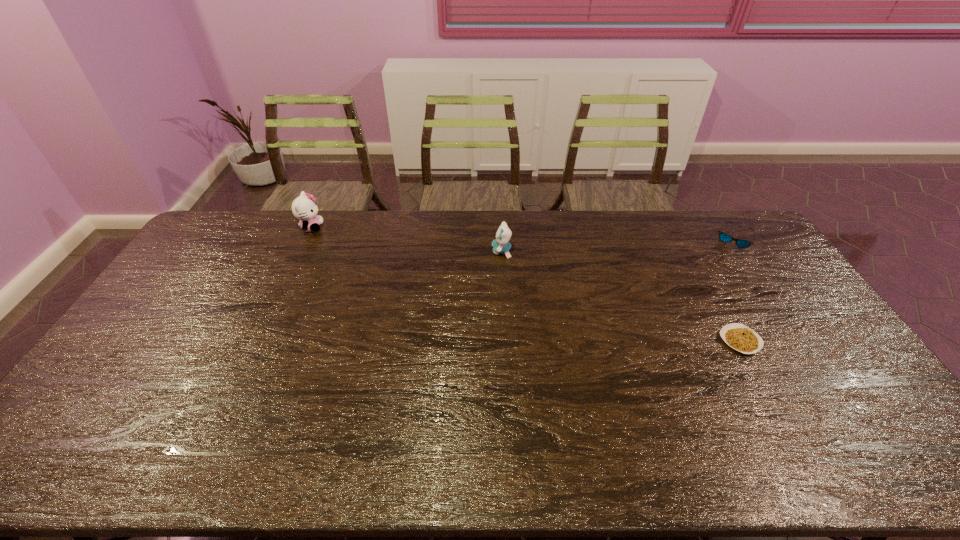
Identify the location of the leftmost object. This screenshot has width=960, height=540. (304, 208).

Locate an element on the screen. The height and width of the screenshot is (540, 960). the tallest object is located at coordinates (304, 208).

The width and height of the screenshot is (960, 540). In order to click on the right kitten in this screenshot , I will do [500, 245].

Locate an element on the screen. Image resolution: width=960 pixels, height=540 pixels. the nearer kitten is located at coordinates (500, 245).

Image resolution: width=960 pixels, height=540 pixels. I want to click on the second shortest object, so click(x=723, y=237).

Identify the location of sunglasses. The width and height of the screenshot is (960, 540). (723, 237).

Identify the location of the second object from right to left. [740, 337].

Where is `the shortest object`? the shortest object is located at coordinates (740, 337).

This screenshot has width=960, height=540. What are the coordinates of `vacant space located 0.230m on the front-facing side of the left kitten` in the screenshot? It's located at (383, 227).

The image size is (960, 540). What are the coordinates of `blank space located 0.200m on the face of the third shortest object` in the screenshot? It's located at (436, 251).